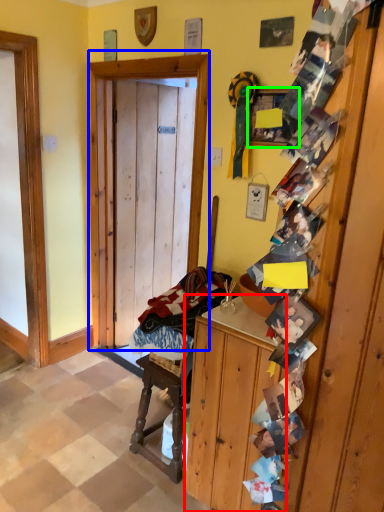
Question: Based on their relative distances, which object is farther from cabinetry (highlighted by a red box)? Choose from door (highlighted by a blue box) and picture frame (highlighted by a green box).

Choices:
 (A) door
 (B) picture frame

Answer: (B)